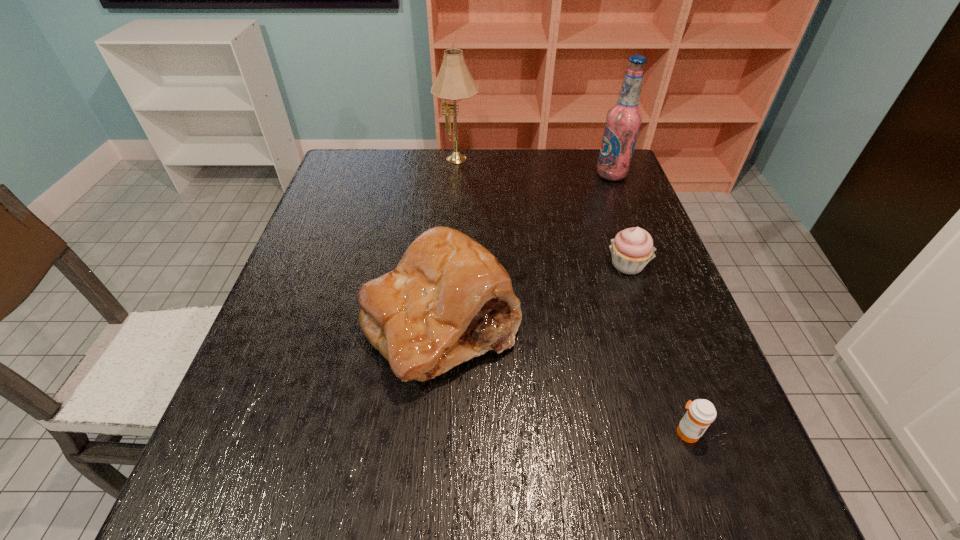
Find the location of a particular element. The image size is (960, 540). vacant space at the right edge is located at coordinates (586, 205).

In the image, there is a desktop. Where is `vacant space at the far left corner`? The height and width of the screenshot is (540, 960). vacant space at the far left corner is located at coordinates (368, 177).

Where is `free space at the near right corner`? This screenshot has width=960, height=540. free space at the near right corner is located at coordinates (752, 516).

Find the location of a particular element. The image size is (960, 540). free space that is in between the fourth tallest object and the nearest object is located at coordinates (657, 348).

The image size is (960, 540). I want to click on unoccupied area between the alcohol and the cupcake, so click(619, 220).

Where is `vacant space that is in between the bread and the cupcake`? The height and width of the screenshot is (540, 960). vacant space that is in between the bread and the cupcake is located at coordinates (534, 294).

The height and width of the screenshot is (540, 960). What are the coordinates of `unoccupied area between the nearest object and the bread` in the screenshot? It's located at (564, 377).

Identify the location of unoccupied position between the lampshade and the medicine. This screenshot has width=960, height=540. (572, 296).

Identify the location of vacant area that lies between the third shortest object and the cupcake. The width and height of the screenshot is (960, 540). (534, 294).

The image size is (960, 540). Identify the location of unoccupied area between the third shortest object and the shortest object. (564, 377).